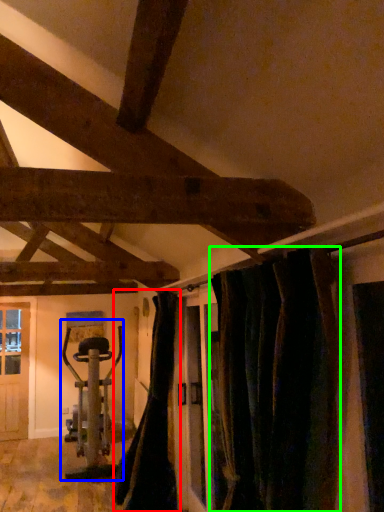
Question: Which is nearer to the curtain (highlighted by a red box)? sport equipment (highlighted by a blue box) or curtain (highlighted by a green box).

Choices:
 (A) sport equipment
 (B) curtain

Answer: (A)